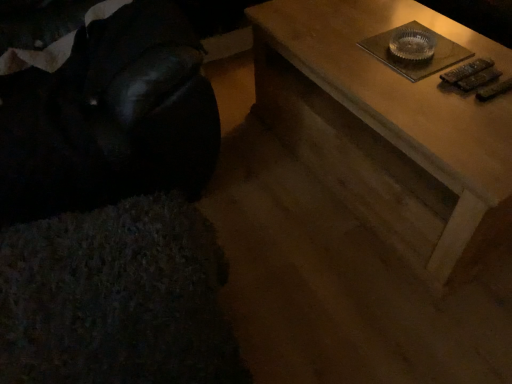
Question: Does point (41, 102) appear closer or farther from the camera than point (498, 221)?

Choices:
 (A) farther
 (B) closer

Answer: (A)

Question: In the image, is velvet black bean bag chair at left on the left side or the right side of wooden table at upper right?

Choices:
 (A) left
 (B) right

Answer: (A)

Question: Is velvet black bean bag chair at left bigger or smaller than wooden table at upper right?

Choices:
 (A) small
 (B) big

Answer: (B)

Question: Considering their positions, is wooden table at upper right located in front of or behind velvet black bean bag chair at left?

Choices:
 (A) behind
 (B) front

Answer: (A)

Question: From the image's perspective, is wooden table at upper right located above or below velvet black bean bag chair at left?

Choices:
 (A) above
 (B) below

Answer: (B)

Question: From a real-world perspective, relative to velvet black bean bag chair at left, is wooden table at upper right vertically above or below?

Choices:
 (A) below
 (B) above

Answer: (A)

Question: Is wooden table at upper right bigger or smaller than velvet black bean bag chair at left?

Choices:
 (A) big
 (B) small

Answer: (B)